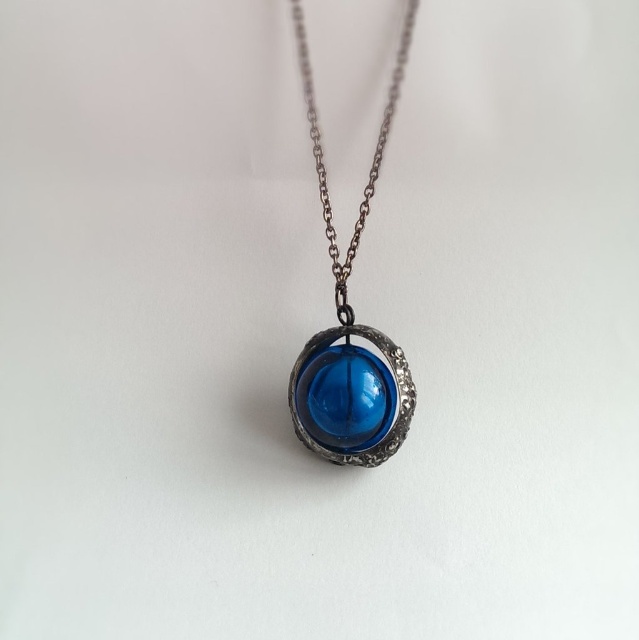
From the picture: You are a jeweler examining the necklace. You need to determine if the transparent glass sphere at center can fit through the links of the gunmetal chain at center. Based on their sizes, what is your conclusion?

The transparent glass sphere at center has a smaller size compared to the gunmetal chain at center. Since the sphere is smaller than the chain links, it can fit through the links.

Consider the image. You are taking a photo of the transparent glass sphere at center using a camera. The camera is set to a focal length of 50mm. If the sphere is 4.40 feet away from the camera, what is the approximate size of the sphere in the photo? Assume the sphere has a diameter of 2 inches in real life.

The transparent glass sphere at center is 4.40 feet away from the camera. Using the formula for image size calculation, the sphere with a 2 inch diameter would appear approximately 0.23 inches in the photo when captured with a 50mm focal length at that distance.